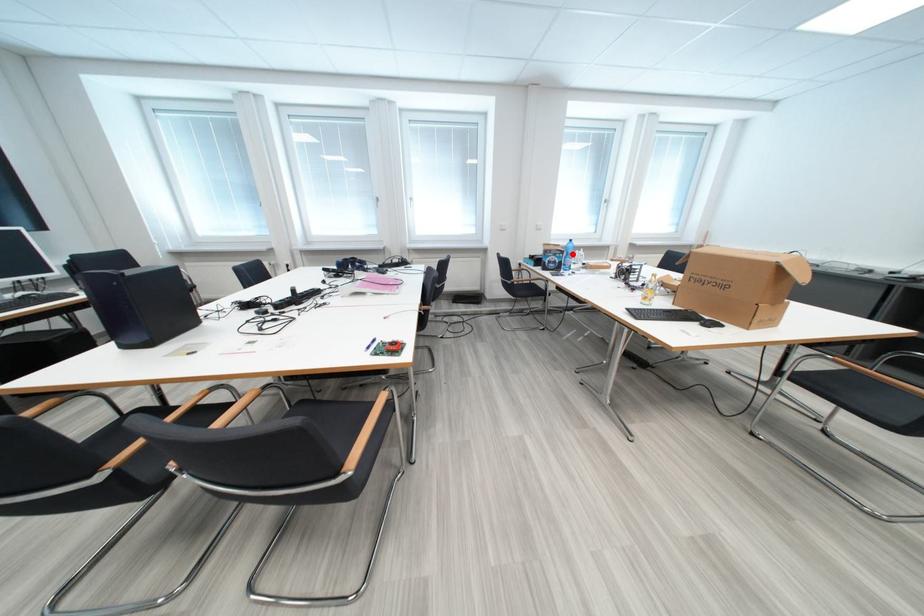
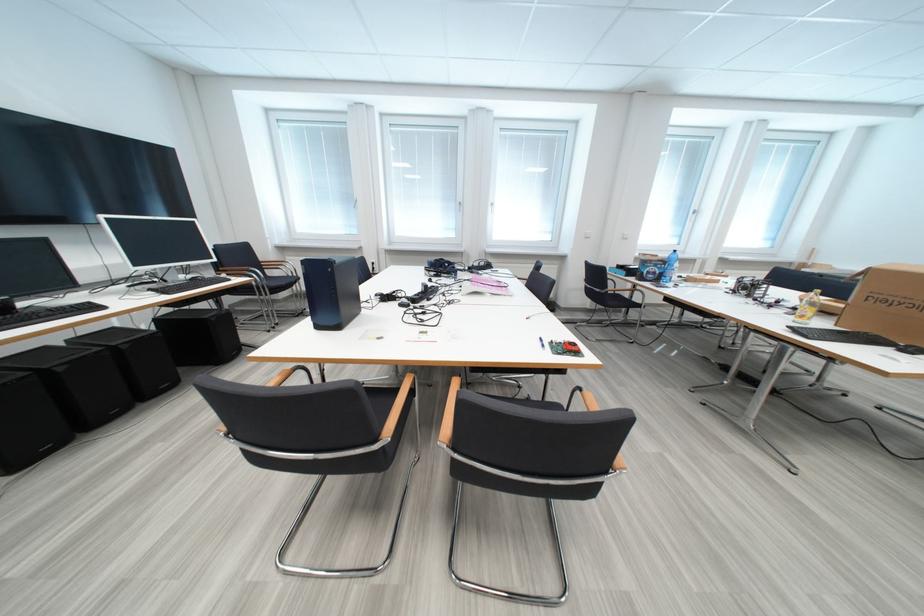
Where in the second image is the point corresponding to the highlighted location from the first image?

(675, 265)